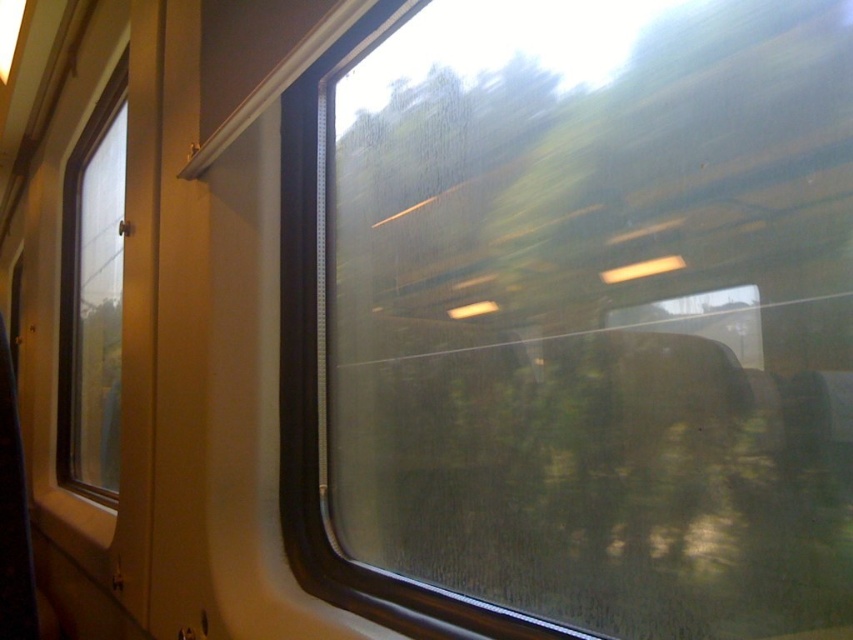
Does transparent glass train window at center appear under transparent glass window at left?

Yes.

Who is shorter, transparent glass train window at center or transparent glass window at left?

Standing shorter between the two is transparent glass train window at center.

Is point (657, 372) positioned behind point (77, 412)?

No, (657, 372) is in front of (77, 412).

Locate an element on the screen. transparent glass train window at center is located at coordinates (573, 317).